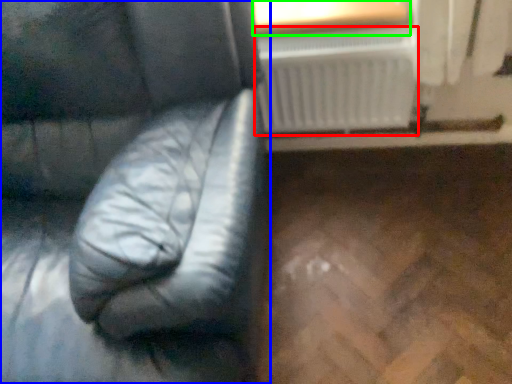
Question: Considering the real-world distances, which object is closest to radiator (highlighted by a red box)? furniture (highlighted by a blue box) or window frame (highlighted by a green box).

Choices:
 (A) furniture
 (B) window frame

Answer: (B)